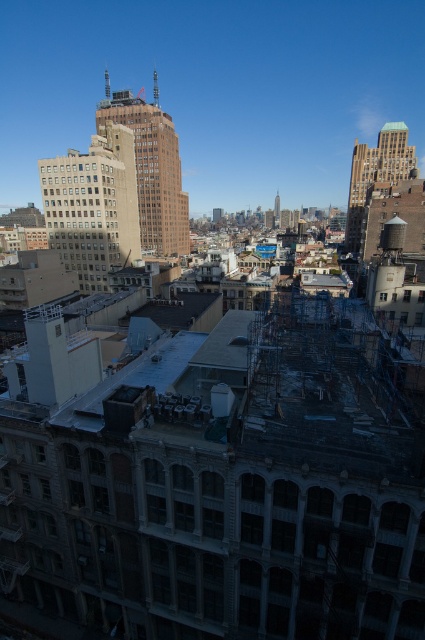
Question: Which of the following is the farthest from the observer?

Choices:
 (A) click(x=243, y=404)
 (B) click(x=159, y=150)
 (C) click(x=101, y=156)
 (D) click(x=391, y=129)

Answer: (D)

Question: Is matte glass building at center wider than brown brick building at upper center?

Choices:
 (A) no
 (B) yes

Answer: (A)

Question: Estimate the real-world distances between objects in this image. Which object is farther from the matte glass building at center?

Choices:
 (A) exposed concrete scaffolding at center
 (B) brown brick building at upper center
 (C) greenish-gray concrete tower at upper right

Answer: (C)

Question: Can you confirm if matte glass building at center is positioned to the left of greenish-gray concrete tower at upper right?

Choices:
 (A) yes
 (B) no

Answer: (A)

Question: Estimate the real-world distances between objects in this image. Which object is closer to the matte glass building at center?

Choices:
 (A) brown brick building at upper center
 (B) greenish-gray concrete tower at upper right
 (C) exposed concrete scaffolding at center

Answer: (A)

Question: Is exposed concrete scaffolding at center closer to the viewer compared to matte glass building at center?

Choices:
 (A) no
 (B) yes

Answer: (B)